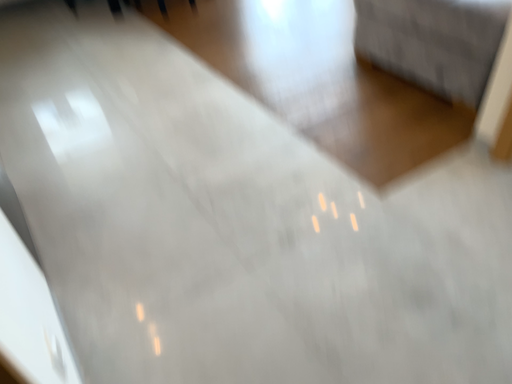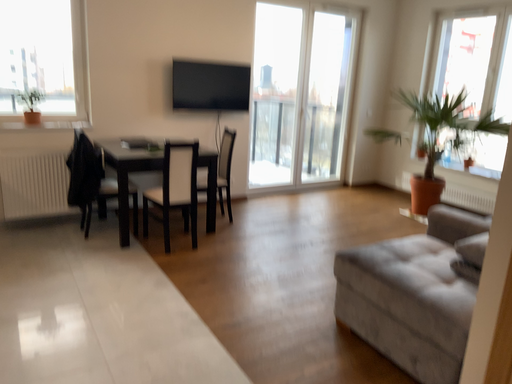
Question: How did the camera likely rotate when shooting the video?

Choices:
 (A) rotated upward
 (B) rotated downward

Answer: (A)